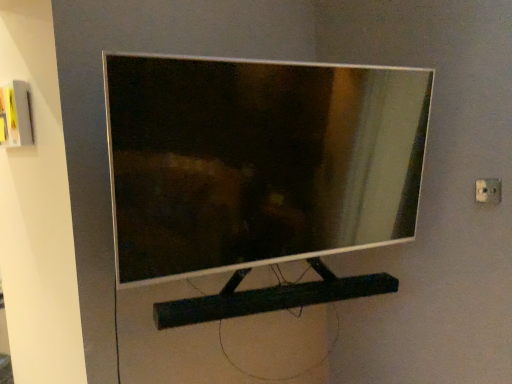
Looking at this image, measure the distance between point (487, 198) and camera.

Point (487, 198) is 1.55 meters from camera.

The image size is (512, 384). I want to click on matte gray electric outlet at upper right, so click(488, 190).

Describe the element at coordinates (488, 190) in the screenshot. I see `matte gray electric outlet at upper right` at that location.

The width and height of the screenshot is (512, 384). Identify the location of matte gray electric outlet at upper right. (488, 190).